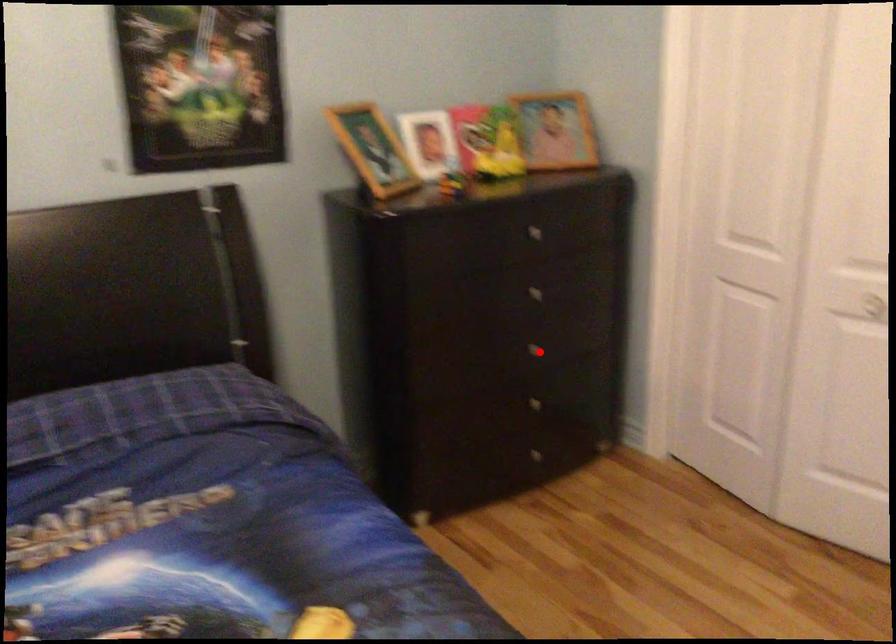
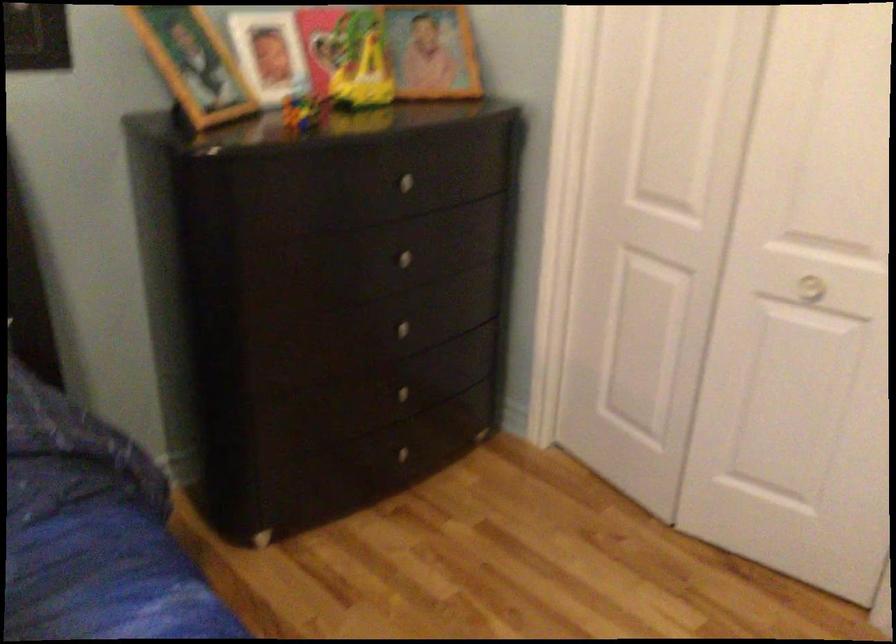
The point at the highlighted location is marked in the first image. Where is the corresponding point in the second image?

(409, 332)